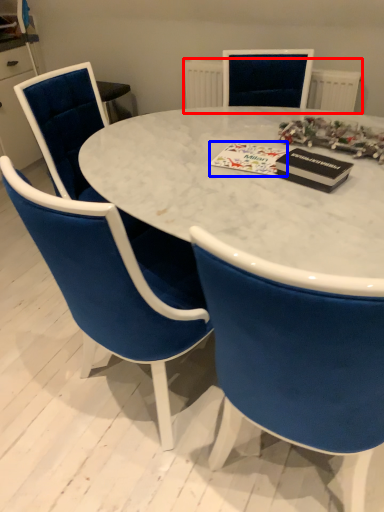
Question: Among these objects, which one is farthest to the camera, radiator (highlighted by a red box) or christmas card (highlighted by a blue box)?

Choices:
 (A) radiator
 (B) christmas card

Answer: (A)